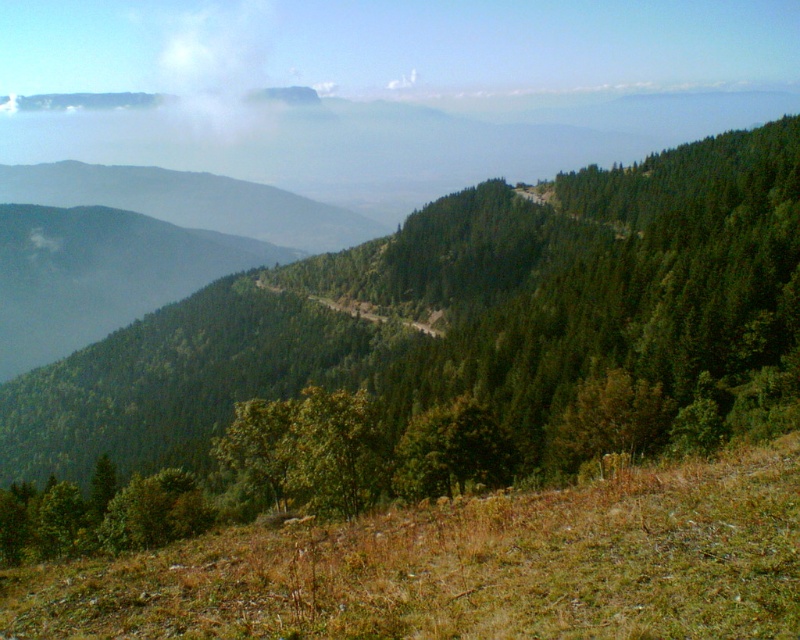
Question: Considering the real-world distances, which object is closest to the green matte tree at center?

Choices:
 (A) white fog at upper left
 (B) green leafy tree at center

Answer: (B)

Question: Is green leafy tree at center smaller than green matte tree at center?

Choices:
 (A) yes
 (B) no

Answer: (B)

Question: Estimate the real-world distances between objects in this image. Which object is closer to the green leafy tree at center?

Choices:
 (A) green matte tree at center
 (B) white fog at upper left

Answer: (A)

Question: Where is white fog at upper left located in relation to green matte tree at center in the image?

Choices:
 (A) above
 (B) below

Answer: (A)

Question: Estimate the real-world distances between objects in this image. Which object is farther from the green matte tree at center?

Choices:
 (A) green leafy tree at center
 (B) white fog at upper left

Answer: (B)

Question: Can you confirm if green leafy tree at center is positioned above green matte tree at center?

Choices:
 (A) yes
 (B) no

Answer: (A)